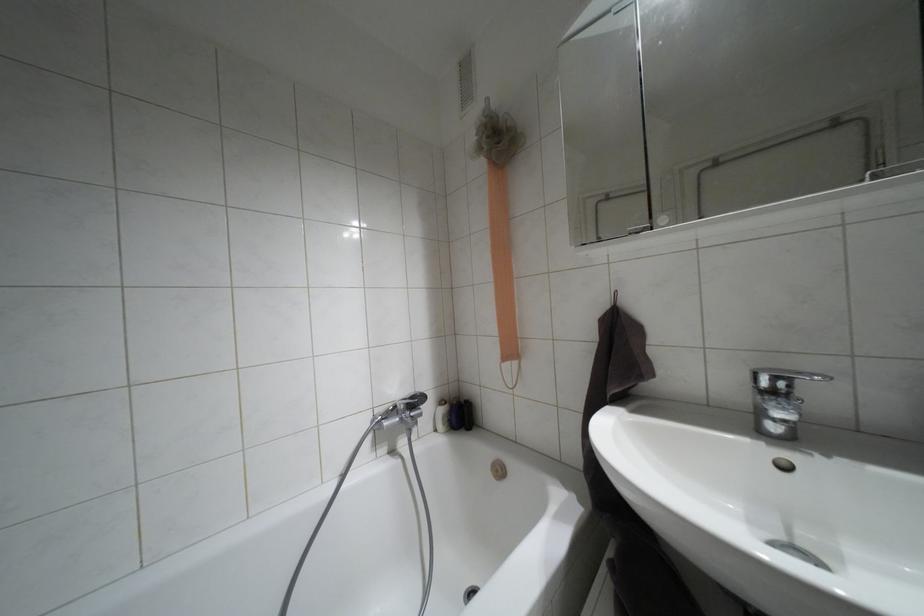
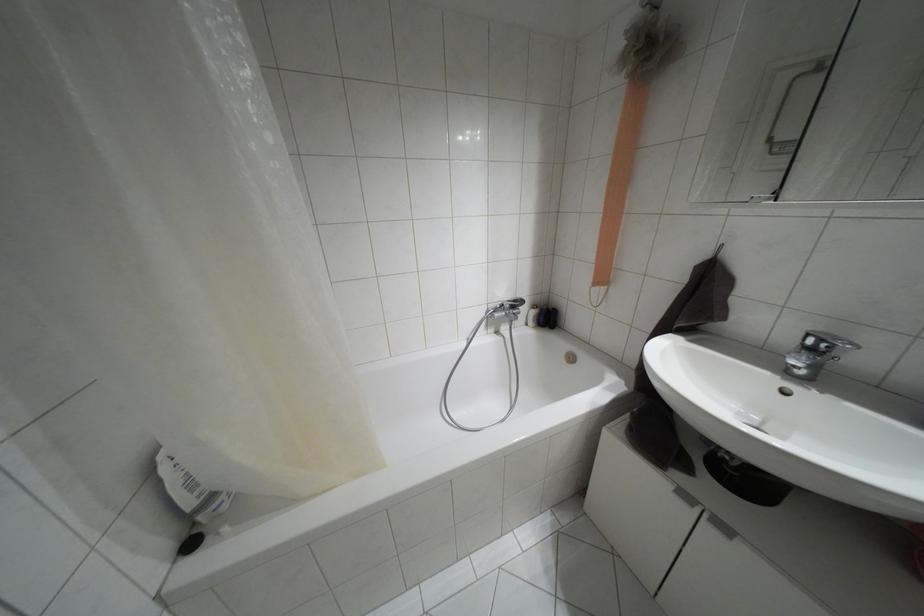
Where in the second image is the point corresponding to point 410,397 from the first image?

(514, 301)